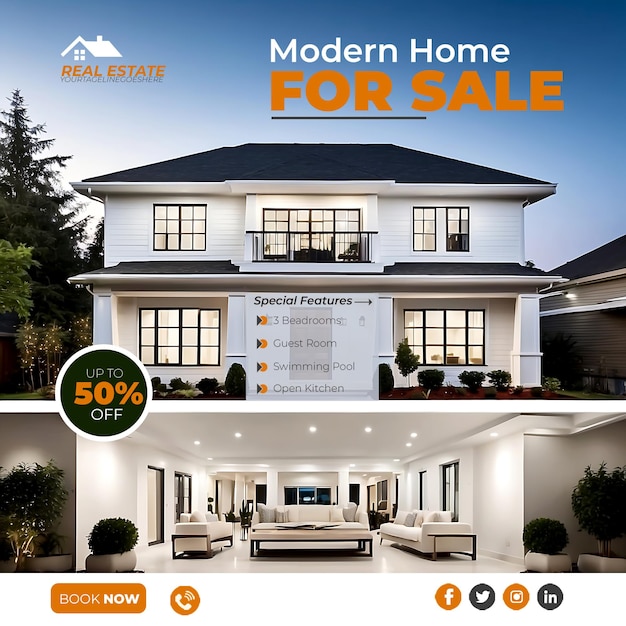
Where is `cushions`? cushions is located at coordinates 434,521, 419,524, 409,524, 352,511, 337,516, 284,518, 270,513, 213,518, 200,521.